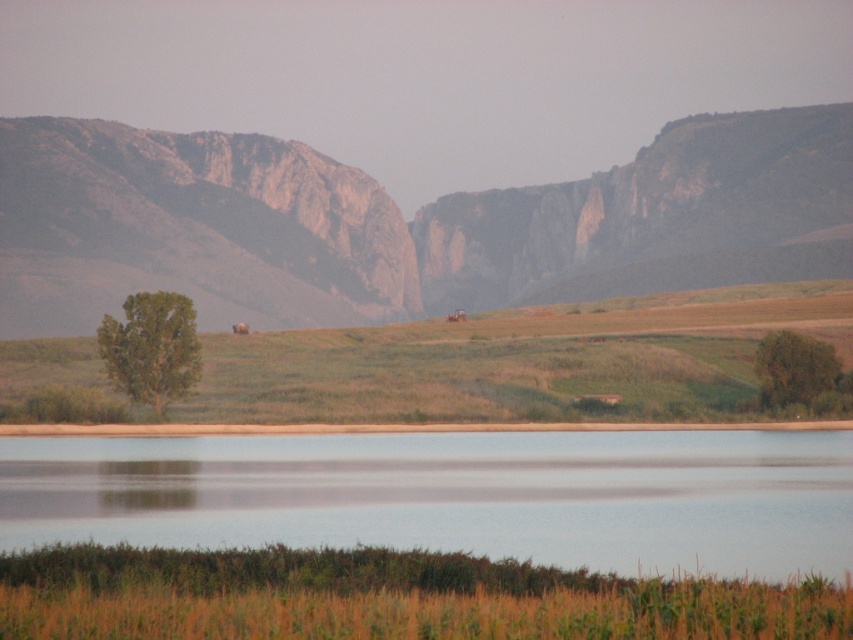
Question: Which point is farther to the camera?

Choices:
 (A) rugged stone mountain at center
 (B) green matte tree at right
 (C) green leafy tree at center

Answer: (A)

Question: Is rugged stone mountain at center to the left of green matte tree at right from the viewer's perspective?

Choices:
 (A) yes
 (B) no

Answer: (A)

Question: Does green leafy tree at center appear on the left side of green matte tree at right?

Choices:
 (A) no
 (B) yes

Answer: (B)

Question: Which object appears closest to the camera in this image?

Choices:
 (A) green matte tree at right
 (B) green leafy tree at center
 (C) transparent water at center

Answer: (C)

Question: In this image, where is transparent water at center located relative to green leafy tree at center?

Choices:
 (A) below
 (B) above

Answer: (A)

Question: Which point appears closest to the camera in this image?

Choices:
 (A) (827, 387)
 (B) (144, 317)
 (C) (500, 438)
 (D) (718, 228)

Answer: (C)